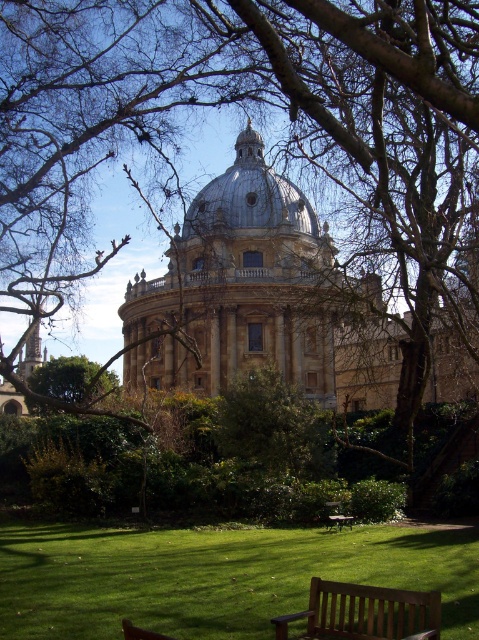
Question: Among these objects, which one is nearest to the camera?

Choices:
 (A) golden stone dome at center
 (B) white stone dome at center
 (C) brown wooden bench at lower center
 (D) wooden bench at lower center

Answer: (D)

Question: Is white stone dome at center in front of wooden bench at lower center?

Choices:
 (A) no
 (B) yes

Answer: (A)

Question: Can you confirm if golden stone dome at center is positioned above brown wooden bench at lower center?

Choices:
 (A) no
 (B) yes

Answer: (B)

Question: Which point is farther to the camera?

Choices:
 (A) white stone dome at center
 (B) wooden bench at lower center
 (C) brown wooden bench at lower center
 (D) golden stone dome at center

Answer: (A)

Question: Among these points, which one is farthest from the camera?

Choices:
 (A) (318, 266)
 (B) (340, 524)

Answer: (A)

Question: Can you confirm if golden stone dome at center is positioned to the right of wooden bench at lower center?

Choices:
 (A) no
 (B) yes

Answer: (A)